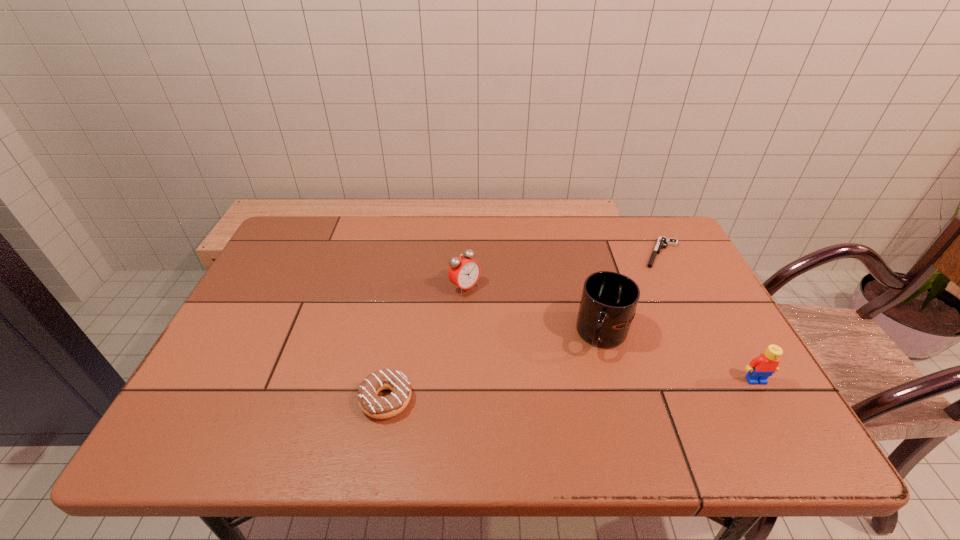
The height and width of the screenshot is (540, 960). What are the coordinates of `the second shortest object` in the screenshot? It's located at (371, 404).

I want to click on the leftmost object, so click(x=371, y=404).

This screenshot has height=540, width=960. In order to click on Lego in this screenshot , I will do `click(760, 368)`.

Locate an element on the screen. alarm clock is located at coordinates (464, 272).

Locate an element on the screen. This screenshot has height=540, width=960. the fourth object from right to left is located at coordinates (464, 272).

The image size is (960, 540). Identify the location of mug. (608, 303).

The image size is (960, 540). I want to click on the third object from left to right, so click(608, 303).

I want to click on the shortest object, so click(x=662, y=242).

Find the location of a particular element. Image resolution: width=960 pixels, height=540 pixels. the farthest object is located at coordinates (662, 242).

This screenshot has width=960, height=540. Identify the location of vacant space situated on the right of the leftmost object. (551, 400).